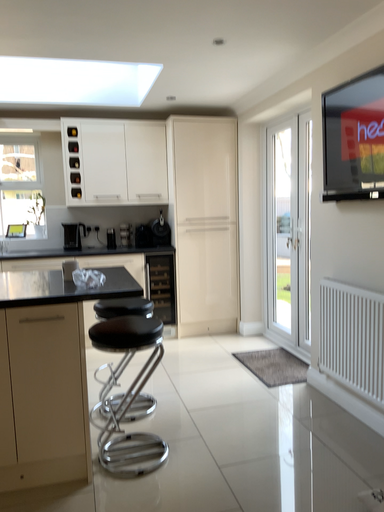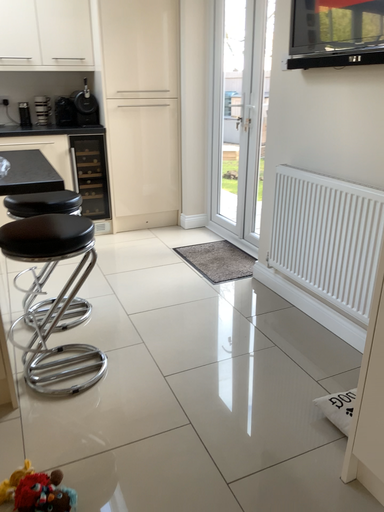
Question: Which way did the camera rotate in the video?

Choices:
 (A) rotated right
 (B) rotated left

Answer: (A)